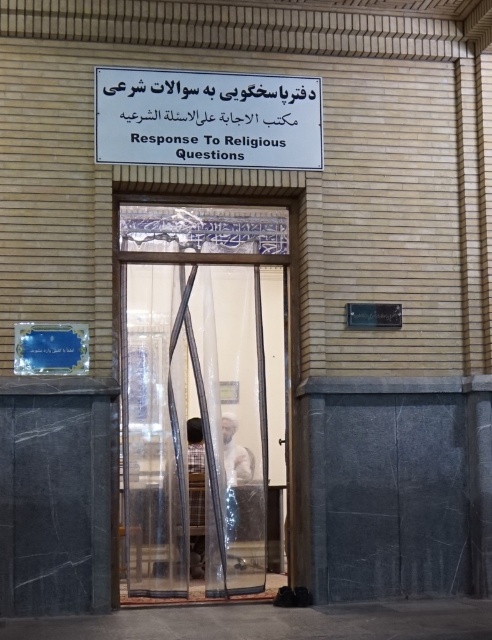
What are the coordinates of the transparent mesh door at center?

The transparent mesh door at center is located at coordinates point [202,394].